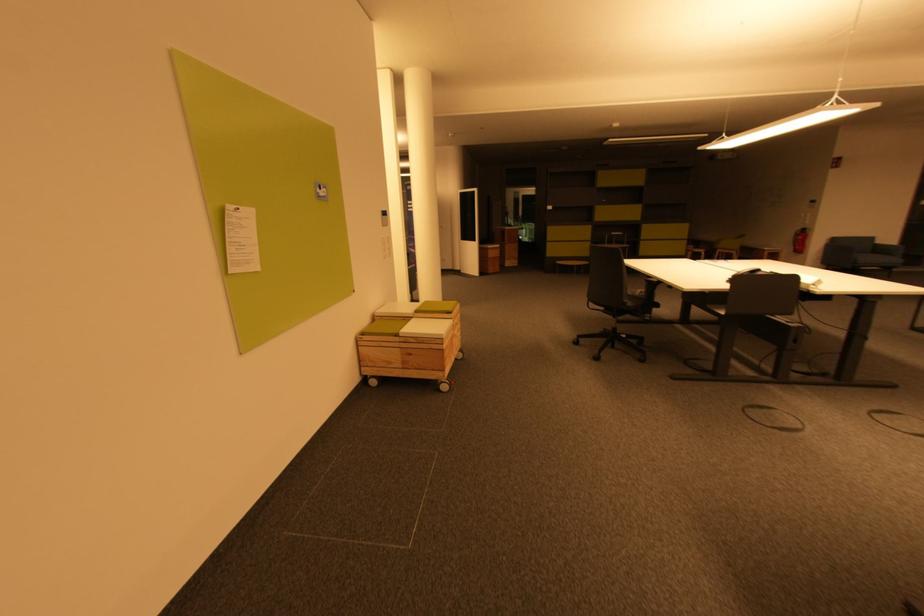
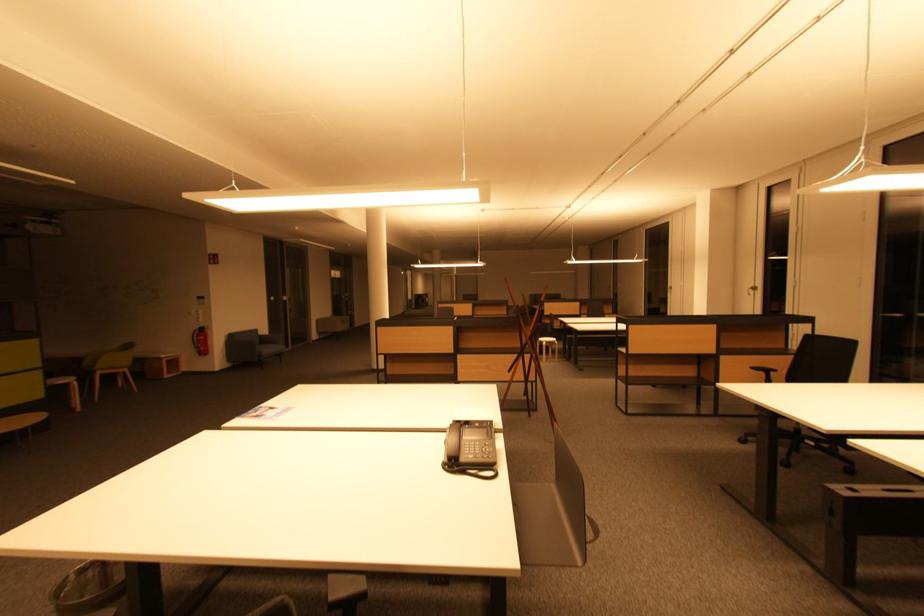
Where in the second image is the point corresponding to the point at 804,252 from the first image?

(207, 353)